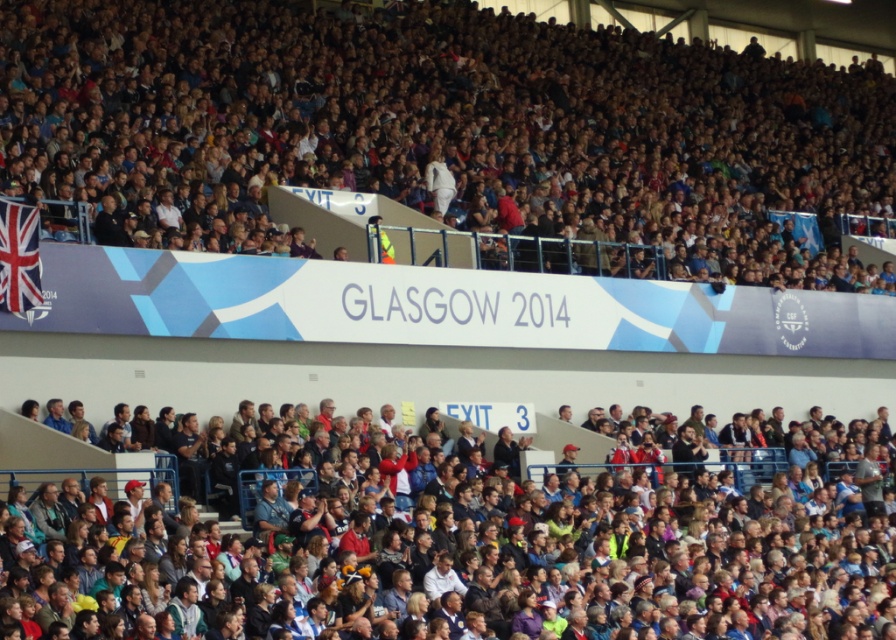
Question: Is matte white banner at upper center to the left of multicolored fabric crowd at lower center from the viewer's perspective?

Choices:
 (A) yes
 (B) no

Answer: (B)

Question: Which point is farther to the camera?

Choices:
 (A) 625,522
 (B) 426,200

Answer: (B)

Question: Is matte white banner at upper center wider than multicolored fabric crowd at lower center?

Choices:
 (A) no
 (B) yes

Answer: (B)

Question: Where is matte white banner at upper center located in relation to multicolored fabric crowd at lower center in the image?

Choices:
 (A) right
 (B) left

Answer: (A)